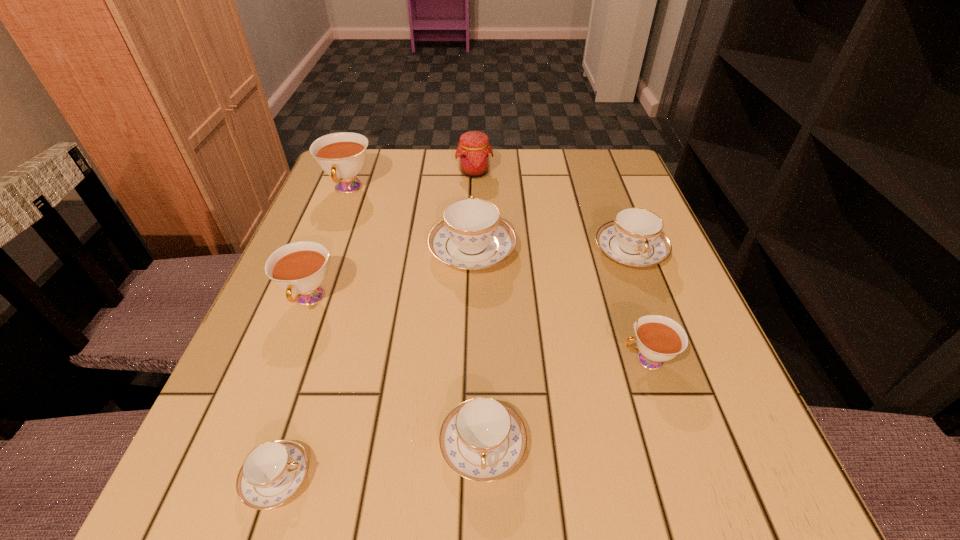
The image size is (960, 540). I want to click on the farthest teacup, so click(x=342, y=155).

Image resolution: width=960 pixels, height=540 pixels. In order to click on the biggest white teacup in this screenshot , I will do `click(342, 155)`.

This screenshot has height=540, width=960. Identify the location of red jam. (474, 152).

Locate an element on the screen. the biggest blue teacup is located at coordinates [x=471, y=236].

The width and height of the screenshot is (960, 540). Identify the location of the second biggest white teacup. (299, 267).

Find the location of a particular element. Image resolution: width=960 pixels, height=540 pixels. the third smallest blue teacup is located at coordinates (635, 237).

Identify the location of the nearest white teacup. (659, 338).

Identify the location of the third nearest teacup. This screenshot has width=960, height=540. (659, 338).

You are a GUI agent. You are given a task and a screenshot of the screen. Output one action in this format:
    pyautogui.click(x=<x>, y=<y>)
    Task: Click on the second smallest blue teacup
    
    Given the screenshot: What is the action you would take?
    pyautogui.click(x=482, y=439)

Find the location of a particular element. This screenshot has width=960, height=540. the shortest teacup is located at coordinates (273, 472).